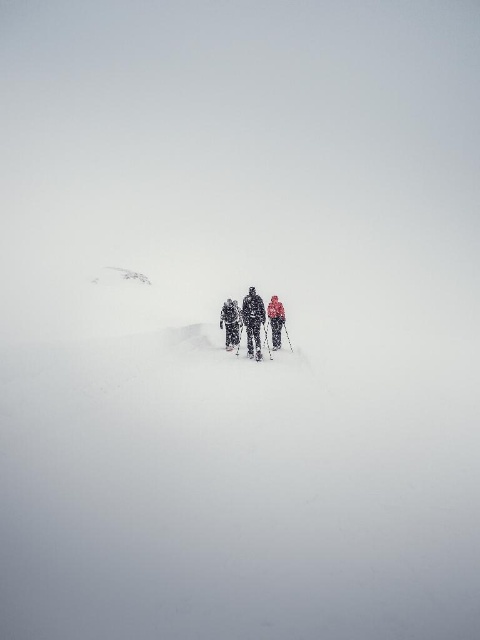
Can you confirm if dark gray ski suit at center is positioned above snow-covered ski suit at center?

Indeed, dark gray ski suit at center is positioned over snow-covered ski suit at center.

Is dark gray ski suit at center thinner than snow-covered ski suit at center?

Yes.

The width and height of the screenshot is (480, 640). In order to click on dark gray ski suit at center in this screenshot , I will do `click(252, 321)`.

Locate an element on the screen. The width and height of the screenshot is (480, 640). dark gray ski suit at center is located at coordinates (252, 321).

Between matte black jacket at center and dark gray ski suit at center, which one is positioned lower?

dark gray ski suit at center is below.

Does matte black jacket at center appear under dark gray ski suit at center?

No.

The image size is (480, 640). What do you see at coordinates (252, 321) in the screenshot? I see `matte black jacket at center` at bounding box center [252, 321].

The height and width of the screenshot is (640, 480). Identify the location of matte black jacket at center. tap(252, 321).

Is white powdery snow at center bigger than dark gray ski suit at center?

Indeed, white powdery snow at center has a larger size compared to dark gray ski suit at center.

Can you confirm if white powdery snow at center is positioned to the right of dark gray ski suit at center?

Yes, white powdery snow at center is to the right of dark gray ski suit at center.

Describe the element at coordinates (236, 492) in the screenshot. I see `white powdery snow at center` at that location.

Locate an element on the screen. The width and height of the screenshot is (480, 640). white powdery snow at center is located at coordinates (236, 492).